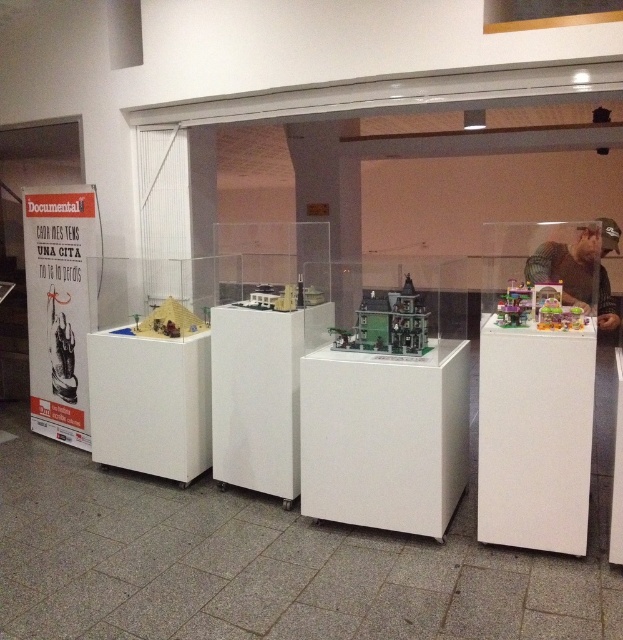
You are an interior designer planning to install a new lighting fixture above the white glossy display case at center and the green mesh shirt at upper right. Which object requires a higher ceiling height to accommodate the lighting fixture?

The white glossy display case at center requires a higher ceiling height because it is taller than the green mesh shirt at upper right, so the lighting fixture above it needs more vertical space.

You are an interior designer planning to move the white glossy display case at center and the green mesh shirt at upper right to a new location. The doorway you are using is 1 meter wide. Can both items fit through the doorway side by side?

The white glossy display case at center is thinner than the green mesh shirt at upper right. Since the doorway is 1 meter wide, if the combined width of both items is less than or equal to 1 meter, they can fit side by side. However, without knowing the exact widths of each item, it is impossible to determine definitively.

Consider the image. You are an attendee at the exhibition and want to take a photo of both the white glossy display case at center and the green mesh shirt at upper right. Which object should you focus on first if you want to capture both in a single frame without moving your camera?

You should focus on the white glossy display case at center first because it is positioned to the left of the green mesh shirt at upper right, so by centering the display case and adjusting the frame to include the shirt on the right, both can be captured in one shot.